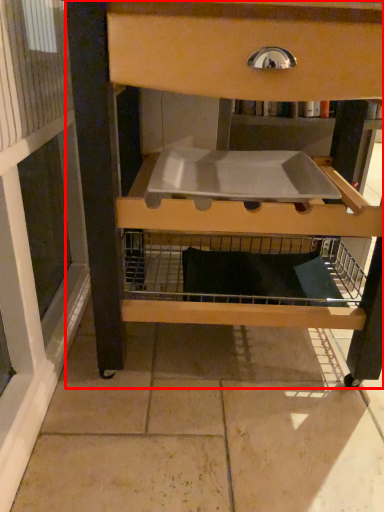
Question: Where is furniture (annotated by the red box) located in relation to sink in the image?

Choices:
 (A) left
 (B) right

Answer: (B)